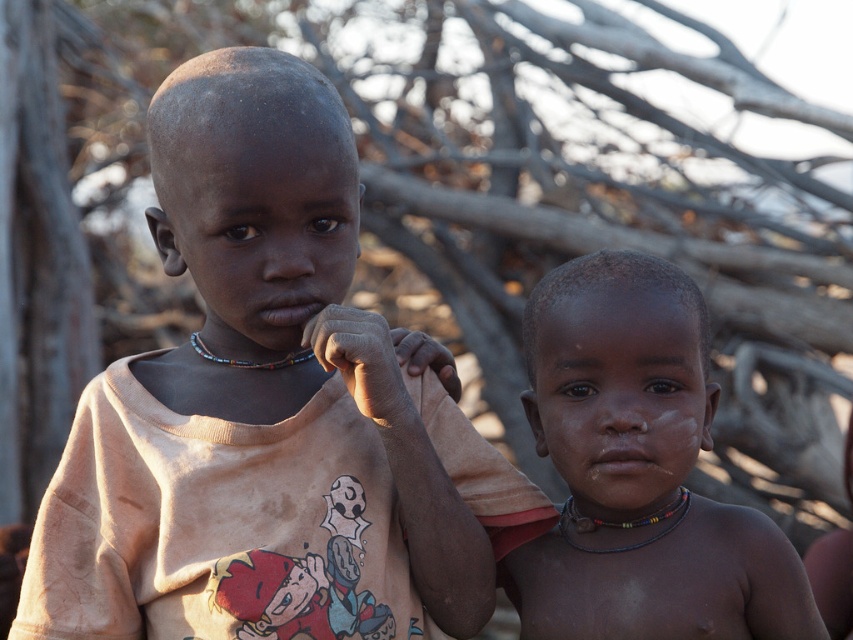
Question: Which of the following is the closest to the observer?

Choices:
 (A) matte skin child at center
 (B) matte orange t-shirt at left

Answer: (B)

Question: Is matte orange t-shirt at left to the right of matte skin child at center from the viewer's perspective?

Choices:
 (A) yes
 (B) no

Answer: (B)

Question: Considering the relative positions of matte orange t-shirt at left and matte skin child at center in the image provided, where is matte orange t-shirt at left located with respect to matte skin child at center?

Choices:
 (A) right
 (B) left

Answer: (B)

Question: In this image, where is matte orange t-shirt at left located relative to matte skin child at center?

Choices:
 (A) left
 (B) right

Answer: (A)